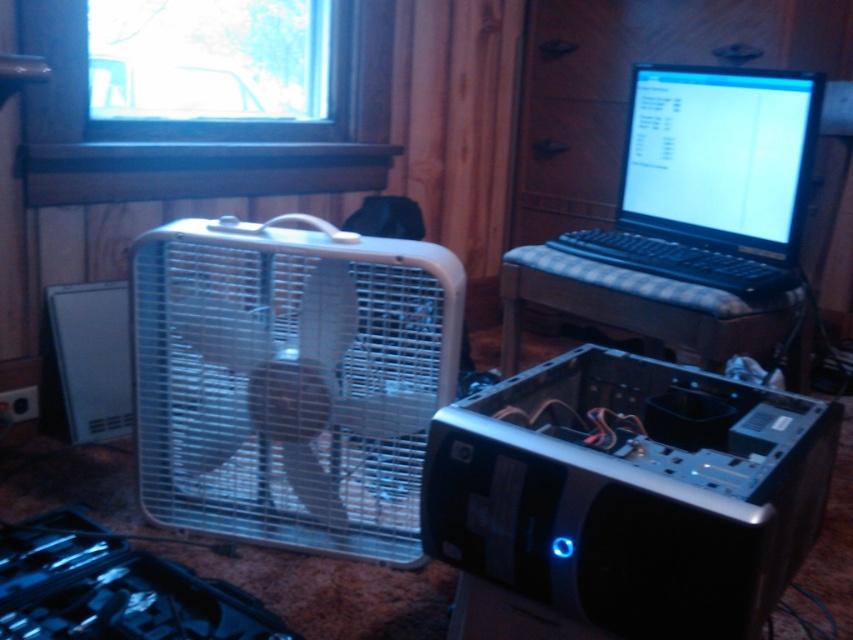
You are setting up a new computer and need to place both the black plastic computer case at center and the black plastic laptop at upper right on a shelf. The shelf has limited space. Based on their positions in the image, which object should you place first to ensure they both fit?

The black plastic computer case at center is located below the black plastic laptop at upper right in the image, which suggests that the laptop is smaller in height. Therefore, you should place the larger computer case first to accommodate both items on the shelf.

You are organizing a workspace and need to move the black plastic laptop at upper right closer to the black plastic computer case at center. Which object should you move first to create space?

You should move the black plastic computer case at center first because it is currently in front of the black plastic laptop at upper right, so moving it will create space to reposition the laptop.